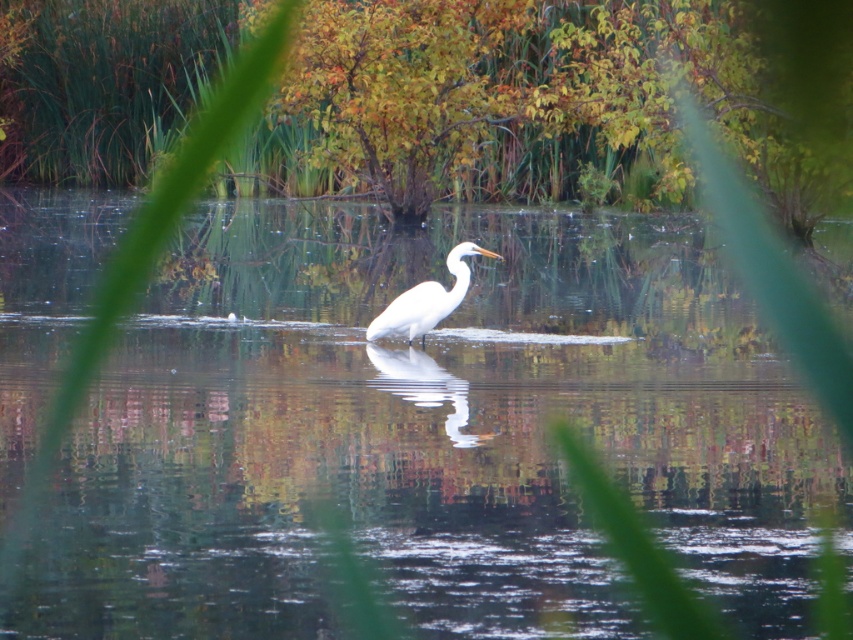
Question: Does clear water at center appear under white smooth heron at center?

Choices:
 (A) yes
 (B) no

Answer: (B)

Question: Considering the relative positions of clear water at center and white smooth heron at center in the image provided, where is clear water at center located with respect to white smooth heron at center?

Choices:
 (A) below
 (B) above

Answer: (B)

Question: Does clear water at center have a smaller size compared to white smooth heron at center?

Choices:
 (A) no
 (B) yes

Answer: (A)